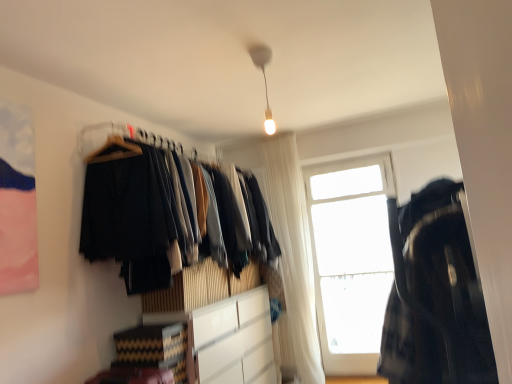
Describe the element at coordinates (351, 259) in the screenshot. This screenshot has height=384, width=512. I see `transparent glass window at upper right` at that location.

In order to face dark plaid shirt at right, should I rotate leftwards or rightwards?

A 21.879 degree turn to the right will do.

The image size is (512, 384). What do you see at coordinates (293, 250) in the screenshot?
I see `white sheer curtain at center` at bounding box center [293, 250].

Find the location of a particular element. The height and width of the screenshot is (384, 512). white glossy light bulb at upper center is located at coordinates (264, 79).

Which point is more forward, (x=294, y=237) or (x=355, y=194)?

The point (x=294, y=237) is closer to the camera.

This screenshot has width=512, height=384. In order to click on curtain in front of the transparent glass window at upper right in this screenshot , I will do `click(293, 250)`.

Which object is closer to the camera taking this photo, white sheer curtain at center or transparent glass window at upper right?

white sheer curtain at center.

From a real-world perspective, between white sheer curtain at center and transparent glass window at upper right, who is vertically lower?

In real-world perspective, transparent glass window at upper right is lower.

This screenshot has height=384, width=512. Find the location of `clothing on the left of transparent glass window at upper right`. clothing on the left of transparent glass window at upper right is located at coordinates (434, 296).

Between transparent glass window at upper right and dark plaid shirt at right, which one is positioned behind?

transparent glass window at upper right.

Considering the sizes of transparent glass window at upper right and dark plaid shirt at right in the image, is transparent glass window at upper right taller or shorter than dark plaid shirt at right?

transparent glass window at upper right is taller than dark plaid shirt at right.

Considering the relative sizes of transparent glass window at upper right and dark plaid shirt at right in the image provided, is transparent glass window at upper right thinner than dark plaid shirt at right?

Correct, the width of transparent glass window at upper right is less than that of dark plaid shirt at right.

Considering the relative sizes of dark plaid shirt at right and white glossy light bulb at upper center in the image provided, is dark plaid shirt at right thinner than white glossy light bulb at upper center?

No.

Can you tell me how much dark plaid shirt at right and white glossy light bulb at upper center differ in facing direction?

91 degrees.

Does point (466, 295) appear closer or farther from the camera than point (265, 94)?

Point (466, 295) is positioned closer to the camera compared to point (265, 94).

Is dark plaid shirt at right to the right of white glossy light bulb at upper center from the viewer's perspective?

Yes.

Is white matte cabinet at center located outside white sheer curtain at center?

Absolutely, white matte cabinet at center is external to white sheer curtain at center.

Can you tell me how much white matte cabinet at center and white sheer curtain at center differ in facing direction?

The angle between the facing direction of white matte cabinet at center and the facing direction of white sheer curtain at center is 88.7 degrees.

You are a GUI agent. You are given a task and a screenshot of the screen. Output one action in this format:
    pyautogui.click(x=<x>, y=<y>)
    Task: Click on the cabinetry in front of the white sheer curtain at center
    The height and width of the screenshot is (384, 512).
    Given the screenshot: What is the action you would take?
    pyautogui.click(x=227, y=339)

Is white matte cabinet at center bigger or smaller than white sheer curtain at center?

Clearly, white matte cabinet at center is larger in size than white sheer curtain at center.

From a real-world perspective, is dark fabric clothes at left positioned above or below white matte cabinet at center?

dark fabric clothes at left is above white matte cabinet at center.

Is dark fabric clothes at left at the right side of white matte cabinet at center?

No.

Is dark fabric clothes at left wider than white matte cabinet at center?

Indeed, dark fabric clothes at left has a greater width compared to white matte cabinet at center.

Which is behind, point (94, 257) or point (197, 352)?

Positioned behind is point (197, 352).

Does transparent glass window at upper right come behind white glossy light bulb at upper center?

That is True.

Based on the photo, from the image's perspective, would you say transparent glass window at upper right is shown under white glossy light bulb at upper center?

Correct, transparent glass window at upper right appears lower than white glossy light bulb at upper center in the image.

Which is more to the left, transparent glass window at upper right or white glossy light bulb at upper center?

From the viewer's perspective, white glossy light bulb at upper center appears more on the left side.

How much distance is there between dark plaid shirt at right and white sheer curtain at center?

dark plaid shirt at right is 7.26 feet from white sheer curtain at center.

Is dark plaid shirt at right looking in the opposite direction of white sheer curtain at center?

dark plaid shirt at right does not have its back to white sheer curtain at center.

Is white sheer curtain at center a part of dark plaid shirt at right?

No, white sheer curtain at center is not inside dark plaid shirt at right.

The image size is (512, 384). Identify the location of curtain above the transparent glass window at upper right (from the image's perspective). (293, 250).

This screenshot has width=512, height=384. I want to click on window that is below the dark plaid shirt at right (from the image's perspective), so click(351, 259).

Estimate the real-world distances between objects in this image. Which object is further from white sheer curtain at center, dark fabric clothes at left or white matte cabinet at center?

Based on the image, dark fabric clothes at left appears to be further to white sheer curtain at center.

Estimate the real-world distances between objects in this image. Which object is further from dark plaid shirt at right, white matte cabinet at center or dark fabric clothes at left?

white matte cabinet at center.

Which object lies further to the anchor point white glossy light bulb at upper center, dark plaid shirt at right or transparent glass window at upper right?

The object further to white glossy light bulb at upper center is transparent glass window at upper right.

Considering their positions, is white sheer curtain at center positioned closer to white matte cabinet at center than white glossy light bulb at upper center?

white sheer curtain at center is positioned closer to the anchor white matte cabinet at center.

Estimate the real-world distances between objects in this image. Which object is closer to dark fabric clothes at left, white matte cabinet at center or transparent glass window at upper right?

white matte cabinet at center lies closer to dark fabric clothes at left than the other object.

Estimate the real-world distances between objects in this image. Which object is further from white matte cabinet at center, dark plaid shirt at right or dark fabric clothes at left?

dark plaid shirt at right is positioned further to the anchor white matte cabinet at center.

When comparing their distances from white sheer curtain at center, does dark plaid shirt at right or transparent glass window at upper right seem closer?

transparent glass window at upper right is positioned closer to the anchor white sheer curtain at center.

Estimate the real-world distances between objects in this image. Which object is closer to white sheer curtain at center, white matte cabinet at center or transparent glass window at upper right?

Based on the image, transparent glass window at upper right appears to be nearer to white sheer curtain at center.

Where is `curtain between dark plaid shirt at right and transparent glass window at upper right in the front-back direction`? curtain between dark plaid shirt at right and transparent glass window at upper right in the front-back direction is located at coordinates (293, 250).

You are a GUI agent. You are given a task and a screenshot of the screen. Output one action in this format:
    pyautogui.click(x=<x>, y=<y>)
    Task: Click on the window that lies between white glossy light bulb at upper center and white matte cabinet at center from top to bottom
    
    Given the screenshot: What is the action you would take?
    pyautogui.click(x=351, y=259)

Where is `light fixture between dark fabric clothes at left and white sheer curtain at center in the front-back direction`? This screenshot has height=384, width=512. light fixture between dark fabric clothes at left and white sheer curtain at center in the front-back direction is located at coordinates (264, 79).

At what (x,y) coordinates should I click in order to perform the action: click on curtain between white matte cabinet at center and transparent glass window at upper right from front to back. Please return your answer as a coordinate pair (x, y). The image size is (512, 384). Looking at the image, I should click on (293, 250).